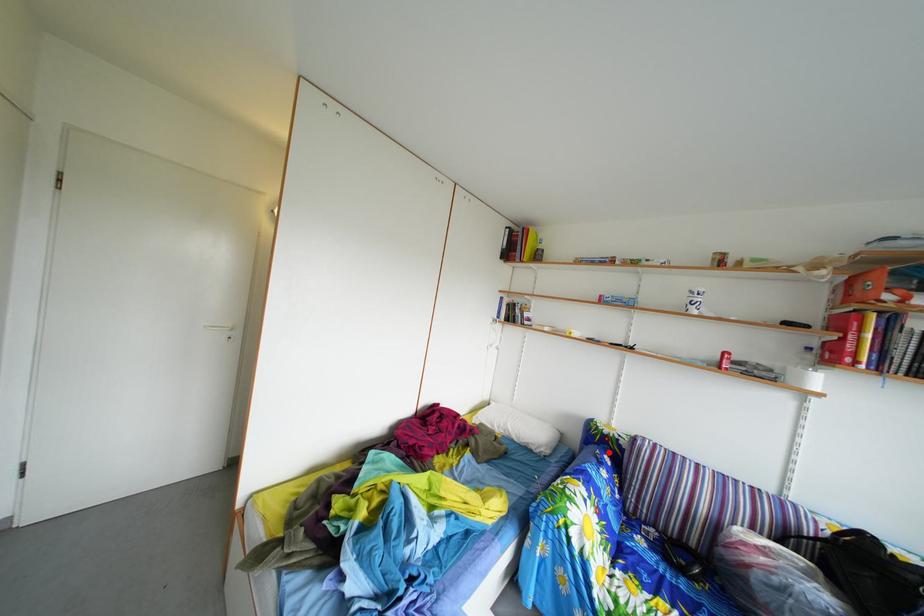
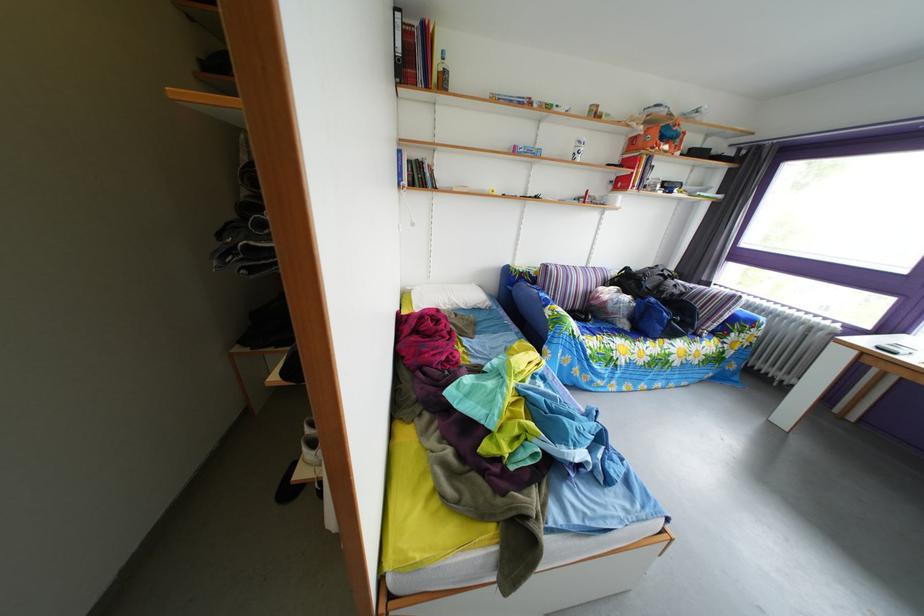
Question: A red point is marked in image1. In image2, is the corresponding 3D point closer to the camera or farther? Reply with the corresponding letter.

Choices:
 (A) The corresponding 3D point is closer.
 (B) The corresponding 3D point is farther.

Answer: (A)